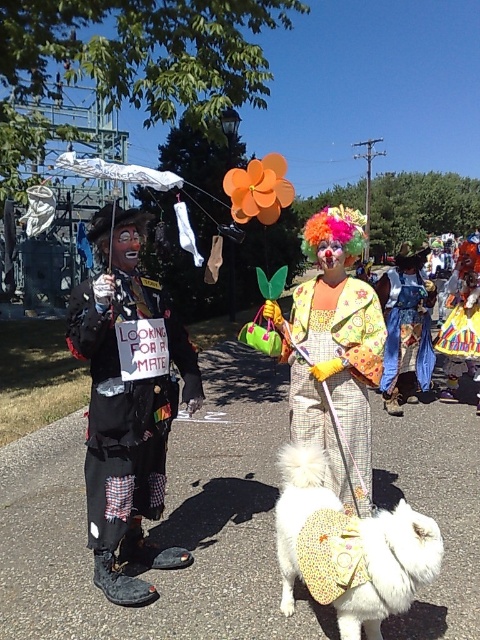
Question: Does white fur dog at center appear on the right side of denim dress at center?

Choices:
 (A) no
 (B) yes

Answer: (A)

Question: Which point is farther to the camera?

Choices:
 (A) (103, 525)
 (B) (355, 310)
 (C) (479, 285)
 (D) (420, 362)

Answer: (C)

Question: Which of the following is the closest to the observer?

Choices:
 (A) denim dress at center
 (B) floral-patterned dress at center

Answer: (A)

Question: Among these points, which one is nearest to the camera?

Choices:
 (A) (403, 273)
 (B) (87, 499)
 (C) (338, 476)
 (D) (348, 598)

Answer: (D)

Question: Does floral-patterned dress at center come behind denim dress at center?

Choices:
 (A) no
 (B) yes

Answer: (B)

Question: Does black leather outfit at left appear on the right side of floral-patterned dress at center?

Choices:
 (A) no
 (B) yes

Answer: (A)